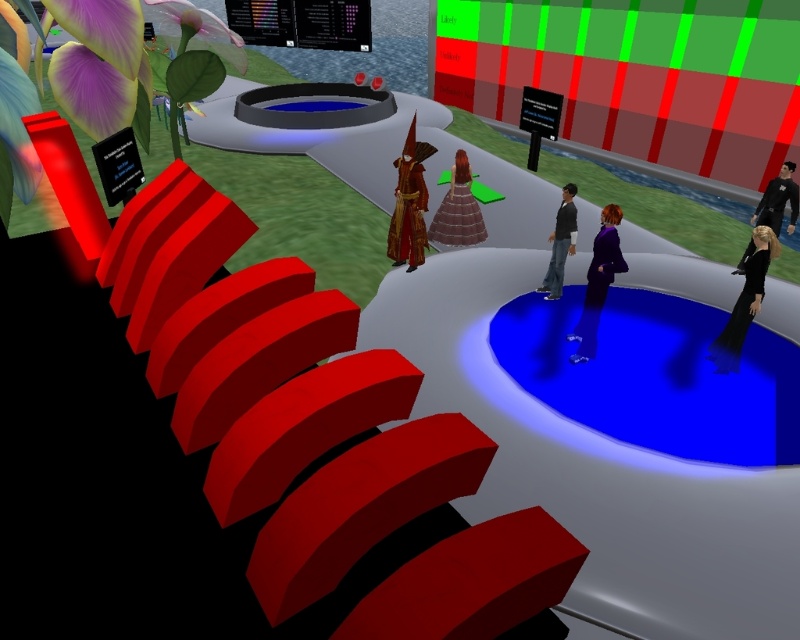
In the scene shown: You are an avatar in this digital world and want to cross from the right side to the left side of the blue glossy pool at center. The black matte suit at right is blocking your path. Can you walk around the pool without stepping on the suit?

The blue glossy pool at center is wider than the black matte suit at right, so yes, you can walk around the pool on either side without stepping on the black matte suit at right.